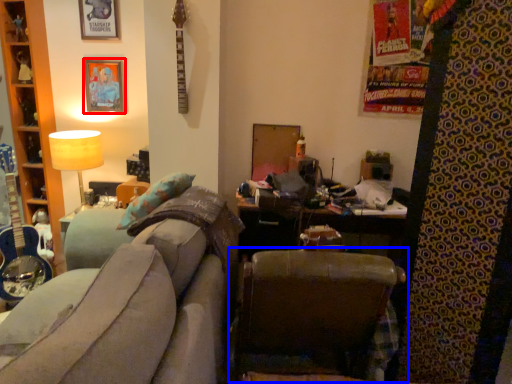
Question: Which point is further to the camera, picture frame (highlighted by a red box) or chair (highlighted by a blue box)?

Choices:
 (A) picture frame
 (B) chair

Answer: (A)